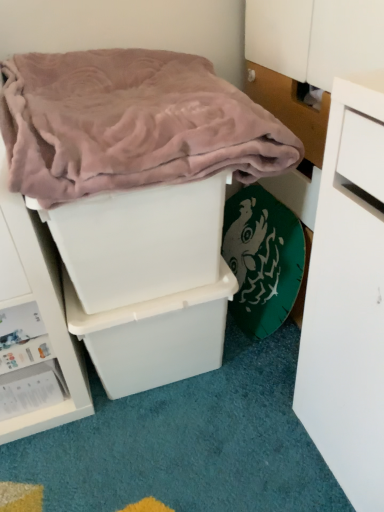
This screenshot has width=384, height=512. What do you see at coordinates (140, 241) in the screenshot?
I see `white plastic storage box at center, placed as the 1th storage box when sorted from top to bottom` at bounding box center [140, 241].

Locate an element on the screen. white plastic storage box at center, placed as the 1th storage box when sorted from top to bottom is located at coordinates (140, 241).

Would you consider pink plush blanket at upper left to be distant from white plastic storage box at lower left, the first storage box ordered from the bottom?

No, pink plush blanket at upper left is not far away from white plastic storage box at lower left, the first storage box ordered from the bottom.

Is pink plush blanket at upper left situated inside white plastic storage box at lower left, acting as the 3th storage box starting from the top, or outside?

pink plush blanket at upper left is not enclosed by white plastic storage box at lower left, acting as the 3th storage box starting from the top.

Can you confirm if pink plush blanket at upper left is smaller than white plastic storage box at lower left, acting as the 3th storage box starting from the top?

No, pink plush blanket at upper left is not smaller than white plastic storage box at lower left, acting as the 3th storage box starting from the top.

From the image's perspective, who appears lower, pink plush blanket at upper left or white plastic storage box at lower left, the first storage box ordered from the bottom?

white plastic storage box at lower left, the first storage box ordered from the bottom, is shown below in the image.

Based on the photo, is white plastic storage box at center, which ranks as the 3th storage box in bottom-to-top order, wider than white plastic storage box at center, placed as the 2th storage box when sorted from top to bottom?

Incorrect, the width of white plastic storage box at center, which ranks as the 3th storage box in bottom-to-top order, does not surpass that of white plastic storage box at center, placed as the 2th storage box when sorted from top to bottom.

Is white plastic storage box at center, placed as the 1th storage box when sorted from top to bottom, far away from white plastic storage box at center, marked as the 2th storage box in a bottom-to-top arrangement?

Actually, white plastic storage box at center, placed as the 1th storage box when sorted from top to bottom, and white plastic storage box at center, marked as the 2th storage box in a bottom-to-top arrangement, are a little close together.

How different are the orientations of white plastic storage box at center, which ranks as the 3th storage box in bottom-to-top order, and white plastic storage box at center, placed as the 2th storage box when sorted from top to bottom, in degrees?

white plastic storage box at center, which ranks as the 3th storage box in bottom-to-top order, and white plastic storage box at center, placed as the 2th storage box when sorted from top to bottom, are facing 1.87 degrees away from each other.

From the image's perspective, would you say white plastic storage box at center, which ranks as the 3th storage box in bottom-to-top order, is positioned over white plastic storage box at center, marked as the 2th storage box in a bottom-to-top arrangement?

Yes, from the image's perspective, white plastic storage box at center, which ranks as the 3th storage box in bottom-to-top order, is above white plastic storage box at center, marked as the 2th storage box in a bottom-to-top arrangement.

Which storage box is the 2nd one when counting from the back of the white plastic storage box at center, placed as the 1th storage box when sorted from top to bottom? Please provide its 2D coordinates.

[(31, 389)]

Is white plastic storage box at center, which ranks as the 3th storage box in bottom-to-top order, thinner than white plastic storage box at lower left, acting as the 3th storage box starting from the top?

Incorrect, the width of white plastic storage box at center, which ranks as the 3th storage box in bottom-to-top order, is not less than that of white plastic storage box at lower left, acting as the 3th storage box starting from the top.

Which object is more forward, white plastic storage box at center, which ranks as the 3th storage box in bottom-to-top order, or white plastic storage box at lower left, the first storage box ordered from the bottom?

white plastic storage box at center, which ranks as the 3th storage box in bottom-to-top order, is more forward.

Can you confirm if white plastic storage box at center, placed as the 1th storage box when sorted from top to bottom, is taller than white plastic storage box at lower left, the first storage box ordered from the bottom?

Yes.

From the image's perspective, is pink plush blanket at upper left located beneath white plastic storage box at center, placed as the 1th storage box when sorted from top to bottom?

Actually, pink plush blanket at upper left appears above white plastic storage box at center, placed as the 1th storage box when sorted from top to bottom, in the image.

Visually, is pink plush blanket at upper left positioned to the left or to the right of white plastic storage box at center, which ranks as the 3th storage box in bottom-to-top order?

In the image, pink plush blanket at upper left appears on the right side of white plastic storage box at center, which ranks as the 3th storage box in bottom-to-top order.

Which object is wider, pink plush blanket at upper left or white plastic storage box at center, placed as the 1th storage box when sorted from top to bottom?

With larger width is pink plush blanket at upper left.

Considering the sizes of pink plush blanket at upper left and white plastic storage box at center, which ranks as the 3th storage box in bottom-to-top order, in the image, is pink plush blanket at upper left taller or shorter than white plastic storage box at center, which ranks as the 3th storage box in bottom-to-top order,?

pink plush blanket at upper left is shorter than white plastic storage box at center, which ranks as the 3th storage box in bottom-to-top order.

Is pink plush blanket at upper left inside or outside of white plastic storage box at center, marked as the 2th storage box in a bottom-to-top arrangement?

pink plush blanket at upper left exists outside the volume of white plastic storage box at center, marked as the 2th storage box in a bottom-to-top arrangement.

From a real-world perspective, is pink plush blanket at upper left positioned above or below white plastic storage box at center, placed as the 2th storage box when sorted from top to bottom?

From a real-world perspective, pink plush blanket at upper left is physically above white plastic storage box at center, placed as the 2th storage box when sorted from top to bottom.

Which is behind, pink plush blanket at upper left or white plastic storage box at center, marked as the 2th storage box in a bottom-to-top arrangement?

Positioned behind is white plastic storage box at center, marked as the 2th storage box in a bottom-to-top arrangement.

Does pink plush blanket at upper left appear on the right side of white plastic storage box at center, marked as the 2th storage box in a bottom-to-top arrangement?

Yes.

From a real-world perspective, is white plastic storage box at center, placed as the 1th storage box when sorted from top to bottom, located beneath pink plush blanket at upper left?

Indeed, from a real-world perspective, white plastic storage box at center, placed as the 1th storage box when sorted from top to bottom, is positioned beneath pink plush blanket at upper left.

From the picture: Considering the relative positions of white plastic storage box at center, which ranks as the 3th storage box in bottom-to-top order, and pink plush blanket at upper left in the image provided, is white plastic storage box at center, which ranks as the 3th storage box in bottom-to-top order, behind pink plush blanket at upper left?

That is True.

Considering the relative positions of white plastic storage box at center, placed as the 1th storage box when sorted from top to bottom, and pink plush blanket at upper left in the image provided, is white plastic storage box at center, placed as the 1th storage box when sorted from top to bottom, to the left or to the right of pink plush blanket at upper left?

Clearly, white plastic storage box at center, placed as the 1th storage box when sorted from top to bottom, is on the left of pink plush blanket at upper left in the image.

Could you tell me if white plastic storage box at center, placed as the 2th storage box when sorted from top to bottom, is turned towards white plastic storage box at lower left, acting as the 3th storage box starting from the top?

No, white plastic storage box at center, placed as the 2th storage box when sorted from top to bottom, is not facing towards white plastic storage box at lower left, acting as the 3th storage box starting from the top.

In the image, there is a white plastic storage box at center, marked as the 2th storage box in a bottom-to-top arrangement. Identify the location of storage box below it (from the image's perspective). The width and height of the screenshot is (384, 512). (31, 389).

Which is closer, (129, 314) or (56, 362)?

The point (129, 314) is in front.

Where is `the 3rd storage box behind the pink plush blanket at upper left, counting from the anchor's position`? This screenshot has width=384, height=512. the 3rd storage box behind the pink plush blanket at upper left, counting from the anchor's position is located at coordinates (31, 389).

Where is `storage box in front of the white plastic storage box at center, placed as the 2th storage box when sorted from top to bottom`? storage box in front of the white plastic storage box at center, placed as the 2th storage box when sorted from top to bottom is located at coordinates (140, 241).

From the image, which object appears to be nearer to white plastic storage box at center, marked as the 2th storage box in a bottom-to-top arrangement, white plastic storage box at lower left, the first storage box ordered from the bottom, or white plastic storage box at center, placed as the 1th storage box when sorted from top to bottom?

white plastic storage box at center, placed as the 1th storage box when sorted from top to bottom, lies closer to white plastic storage box at center, marked as the 2th storage box in a bottom-to-top arrangement, than the other object.

Looking at the image, which one is located closer to pink plush blanket at upper left, white plastic storage box at lower left, the first storage box ordered from the bottom, or white plastic storage box at center, placed as the 1th storage box when sorted from top to bottom?

Based on the image, white plastic storage box at center, placed as the 1th storage box when sorted from top to bottom, appears to be nearer to pink plush blanket at upper left.

Considering their positions, is pink plush blanket at upper left positioned further to white plastic storage box at center, which ranks as the 3th storage box in bottom-to-top order, than white plastic storage box at lower left, acting as the 3th storage box starting from the top?

The object further to white plastic storage box at center, which ranks as the 3th storage box in bottom-to-top order, is white plastic storage box at lower left, acting as the 3th storage box starting from the top.

Based on their spatial positions, is white plastic storage box at center, marked as the 2th storage box in a bottom-to-top arrangement, or white plastic storage box at lower left, acting as the 3th storage box starting from the top, closer to pink plush blanket at upper left?

white plastic storage box at center, marked as the 2th storage box in a bottom-to-top arrangement.

Considering their positions, is pink plush blanket at upper left positioned closer to white plastic storage box at lower left, acting as the 3th storage box starting from the top, than white plastic storage box at center, placed as the 2th storage box when sorted from top to bottom?

white plastic storage box at center, placed as the 2th storage box when sorted from top to bottom.

Estimate the real-world distances between objects in this image. Which object is further from white plastic storage box at center, placed as the 1th storage box when sorted from top to bottom, white plastic storage box at center, placed as the 2th storage box when sorted from top to bottom, or pink plush blanket at upper left?

pink plush blanket at upper left is further to white plastic storage box at center, placed as the 1th storage box when sorted from top to bottom.

Consider the image. Estimate the real-world distances between objects in this image. Which object is further from white plastic storage box at center, marked as the 2th storage box in a bottom-to-top arrangement, white plastic storage box at lower left, the first storage box ordered from the bottom, or pink plush blanket at upper left?

pink plush blanket at upper left is positioned further to the anchor white plastic storage box at center, marked as the 2th storage box in a bottom-to-top arrangement.

Which object lies nearer to the anchor point white plastic storage box at lower left, the first storage box ordered from the bottom, white plastic storage box at center, placed as the 2th storage box when sorted from top to bottom, or white plastic storage box at center, placed as the 1th storage box when sorted from top to bottom?

The object closer to white plastic storage box at lower left, the first storage box ordered from the bottom, is white plastic storage box at center, placed as the 2th storage box when sorted from top to bottom.

The width and height of the screenshot is (384, 512). Identify the location of storage box between white plastic storage box at center, which ranks as the 3th storage box in bottom-to-top order, and white plastic storage box at lower left, acting as the 3th storage box starting from the top, in the vertical direction. (154, 335).

Find the location of `storage box between pink plush blanket at upper left and white plastic storage box at center, marked as the 2th storage box in a bottom-to-top arrangement, from top to bottom`. storage box between pink plush blanket at upper left and white plastic storage box at center, marked as the 2th storage box in a bottom-to-top arrangement, from top to bottom is located at coordinates (140, 241).